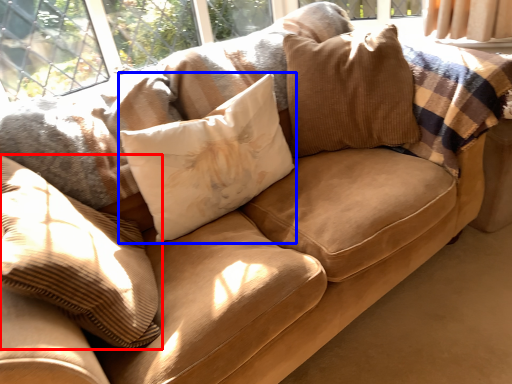
Question: Which of the following is the farthest to the observer, pillow (highlighted by a red box) or pillow (highlighted by a blue box)?

Choices:
 (A) pillow
 (B) pillow

Answer: (B)